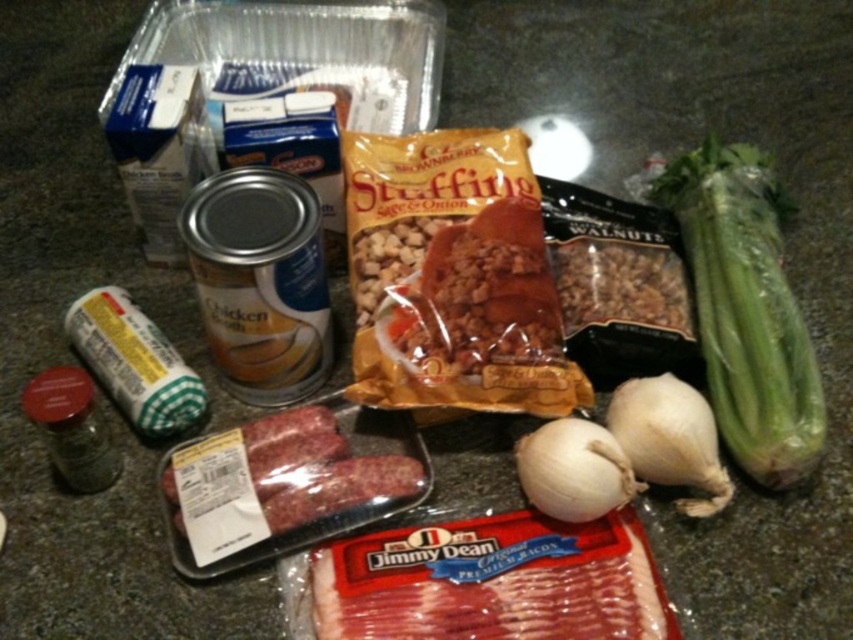
Is green leafy celery at right to the left of brown crumbly stuffing at center from the viewer's perspective?

In fact, green leafy celery at right is to the right of brown crumbly stuffing at center.

Can you confirm if green leafy celery at right is taller than brown crumbly stuffing at center?

Yes.

The height and width of the screenshot is (640, 853). I want to click on green leafy celery at right, so click(x=747, y=310).

The image size is (853, 640). Describe the element at coordinates (747, 310) in the screenshot. I see `green leafy celery at right` at that location.

At what (x,y) coordinates should I click in order to perform the action: click on green leafy celery at right. Please return your answer as a coordinate pair (x, y). Looking at the image, I should click on (747, 310).

Which of these two, white matte garlic at lower right or white matte garlic at center, stands taller?

white matte garlic at lower right is taller.

Based on the photo, is white matte garlic at lower right further to the viewer compared to white matte garlic at center?

Yes, white matte garlic at lower right is behind white matte garlic at center.

Who is more forward, (701, 422) or (572, 464)?

Point (572, 464)

Where is `white matte garlic at lower right`? The image size is (853, 640). white matte garlic at lower right is located at coordinates (670, 440).